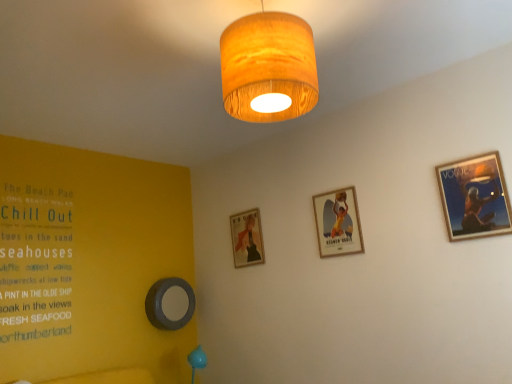
Question: Considering the relative sizes of matte gold picture frame at center, which is counted as the 2th picture frame, starting from the back, and wooden framed poster at upper right, which is the fourth picture frame in left-to-right order, in the image provided, is matte gold picture frame at center, which is counted as the 2th picture frame, starting from the back, bigger than wooden framed poster at upper right, which is the fourth picture frame in left-to-right order,?

Choices:
 (A) no
 (B) yes

Answer: (B)

Question: Is matte gold picture frame at center, the third picture frame positioned from the front, in front of wooden framed poster at upper right, the fourth picture frame when ordered from back to front?

Choices:
 (A) no
 (B) yes

Answer: (A)

Question: Is wooden framed poster at upper right, the 1th picture frame positioned from the front, a part of matte gold picture frame at center, which is the third picture frame from right to left?

Choices:
 (A) no
 (B) yes

Answer: (A)

Question: Is matte gold picture frame at center, which is the third picture frame from right to left, in contact with wooden framed poster at upper right, positioned as the first picture frame in right-to-left order?

Choices:
 (A) yes
 (B) no

Answer: (B)

Question: Is matte gold picture frame at center, the third picture frame positioned from the front, shorter than wooden framed poster at upper right, the fourth picture frame when ordered from back to front?

Choices:
 (A) yes
 (B) no

Answer: (B)

Question: Is wooden drum lampshade at upper center taller or shorter than metallic gray circle at lower left, marked as the 4th picture frame in a front-to-back arrangement?

Choices:
 (A) tall
 (B) short

Answer: (A)

Question: Is wooden drum lampshade at upper center to the left or to the right of metallic gray circle at lower left, the fourth picture frame viewed from the right, in the image?

Choices:
 (A) left
 (B) right

Answer: (B)

Question: In terms of width, does wooden drum lampshade at upper center look wider or thinner when compared to metallic gray circle at lower left, the first picture frame when ordered from left to right?

Choices:
 (A) wide
 (B) thin

Answer: (A)

Question: Considering the positions of point (294, 117) and point (145, 311), is point (294, 117) closer or farther from the camera than point (145, 311)?

Choices:
 (A) closer
 (B) farther

Answer: (A)

Question: Is point (226, 110) closer or farther from the camera than point (245, 256)?

Choices:
 (A) closer
 (B) farther

Answer: (A)

Question: From a real-world perspective, is wooden drum lampshade at upper center above or below matte gold picture frame at center, the third picture frame positioned from the front?

Choices:
 (A) below
 (B) above

Answer: (B)

Question: Is wooden drum lampshade at upper center taller or shorter than matte gold picture frame at center, the third picture frame positioned from the front?

Choices:
 (A) short
 (B) tall

Answer: (B)

Question: From the image's perspective, is wooden drum lampshade at upper center located above or below matte gold picture frame at center, the second picture frame from the left?

Choices:
 (A) below
 (B) above

Answer: (B)

Question: Is wooden framed poster at upper right, the 1th picture frame positioned from the front, taller or shorter than wooden framed poster at center, the 2th picture frame positioned from the front?

Choices:
 (A) tall
 (B) short

Answer: (B)

Question: In terms of width, does wooden framed poster at upper right, positioned as the first picture frame in right-to-left order, look wider or thinner when compared to wooden framed poster at center, placed as the third picture frame when sorted from left to right?

Choices:
 (A) thin
 (B) wide

Answer: (A)